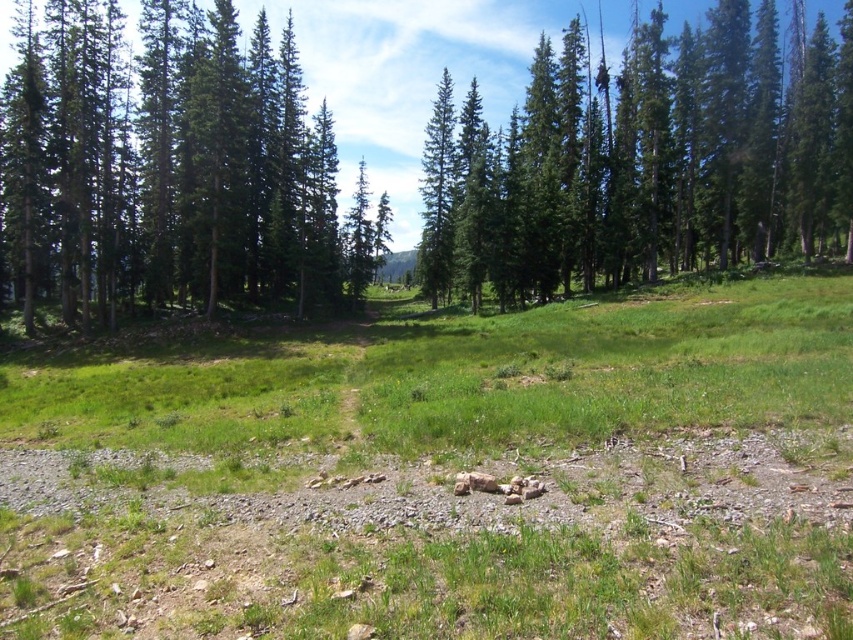
You are a hiker trying to navigate through the forest. You have to pass between the green coniferous forest at center and the green coniferous trees at upper center. Which direction should you go to avoid getting lost?

To avoid getting lost, you should go towards the green coniferous forest at center since it is wider than the green coniferous trees at upper center, providing a clearer path.

You are navigating through the forest and want to reach the point at coordinates point (480, 253) and point (26, 144). Which point is closer to your current position?

Point (480, 253) is further to the viewer than point (26, 144), so point (26, 144) is closer to your current position.